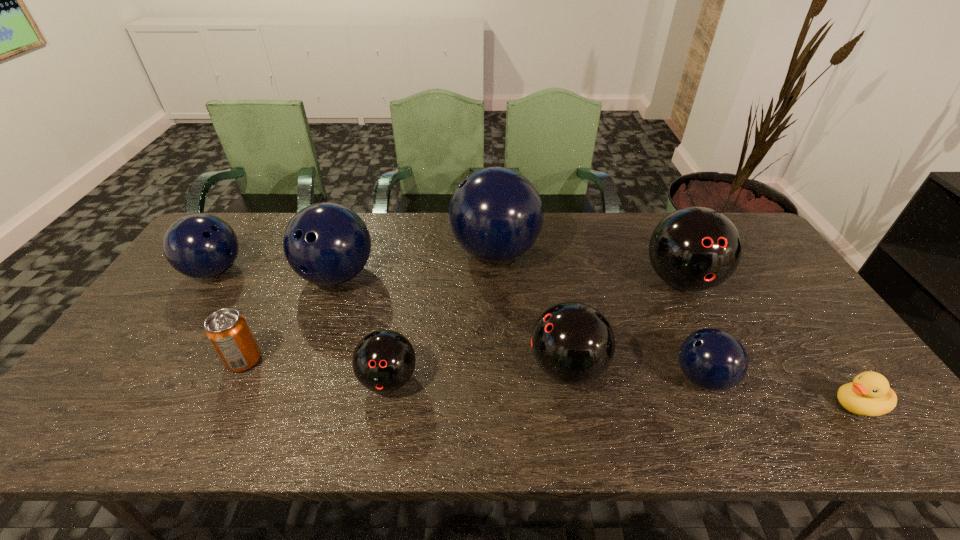
Where is `free space at the left edge`? free space at the left edge is located at coordinates (145, 343).

Where is `vacant area at the right edge`? vacant area at the right edge is located at coordinates coord(783,274).

This screenshot has width=960, height=540. Identify the location of free spot between the second bowling ball from left to right and the leftmost black bowling ball. (363, 327).

In order to click on empty space between the tallest bowling ball and the shortest object in this screenshot , I will do `click(676, 328)`.

Find the location of a particular element. The width and height of the screenshot is (960, 540). free space between the farthest black bowling ball and the second blue bowling ball from left to right is located at coordinates (509, 278).

I want to click on free space between the leftmost blue bowling ball and the second smallest black bowling ball, so click(391, 319).

The height and width of the screenshot is (540, 960). I want to click on free space between the farthest black bowling ball and the rightmost object, so click(x=769, y=343).

You are a GUI agent. You are given a task and a screenshot of the screen. Output one action in this format:
    pyautogui.click(x=<x>, y=<y>)
    Task: Click on the vacant space that's between the yellow duckling and the nearest blue bowling ball
    The height and width of the screenshot is (540, 960).
    Given the screenshot: What is the action you would take?
    coord(780,392)

The height and width of the screenshot is (540, 960). In order to click on free space between the rightmost blue bowling ball and the second bowling ball from left to right in this screenshot , I will do `click(519, 327)`.

The image size is (960, 540). I want to click on free space between the third bowling ball from left to right and the rightmost object, so click(x=623, y=392).